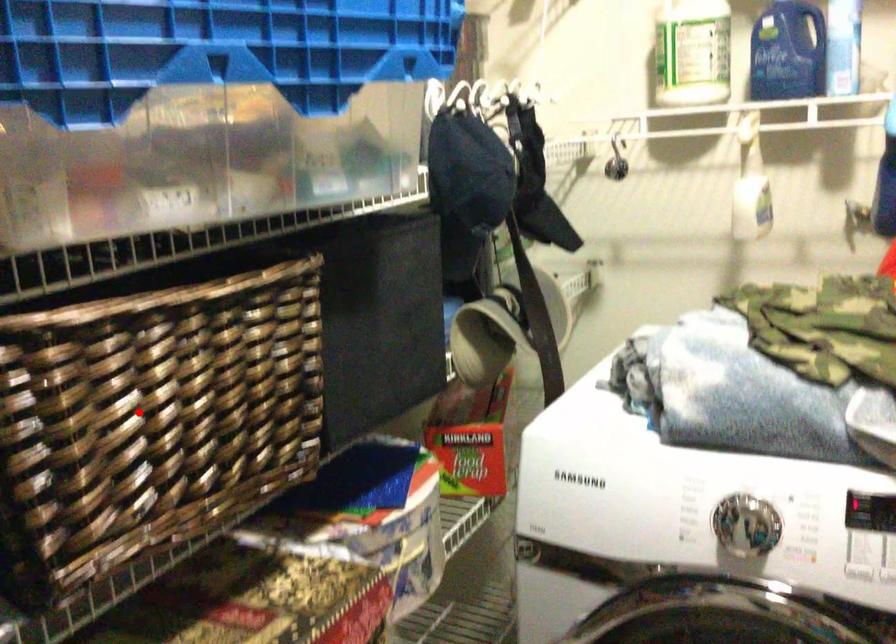
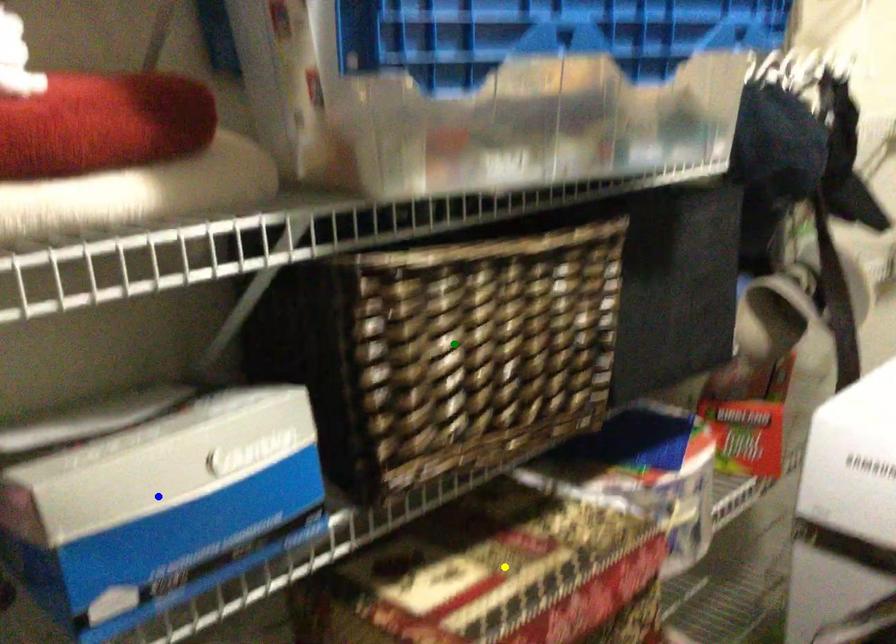
Question: I am providing you with two images of the same scene from different viewpoints. A red point is marked on the first image. You are given multiple points on the second image. Can you choose the point in image 2 that corresponds to the point in image 1?

Choices:
 (A) blue point
 (B) yellow point
 (C) green point

Answer: (C)